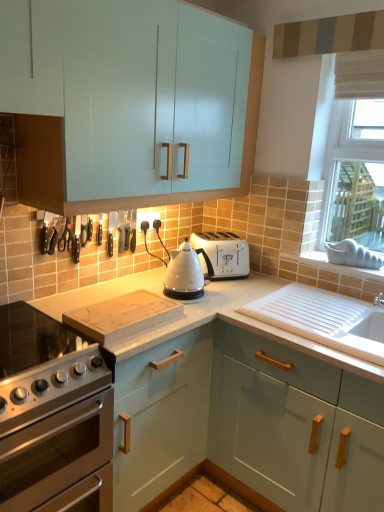
Question: Is satin silver gas stove at lower left taller than white ceramic sink at lower right?

Choices:
 (A) yes
 (B) no

Answer: (A)

Question: Does satin silver gas stove at lower left have a lesser width compared to white ceramic sink at lower right?

Choices:
 (A) yes
 (B) no

Answer: (B)

Question: Does satin silver gas stove at lower left turn towards white ceramic sink at lower right?

Choices:
 (A) no
 (B) yes

Answer: (A)

Question: Is white ceramic sink at lower right inside satin silver gas stove at lower left?

Choices:
 (A) no
 (B) yes

Answer: (A)

Question: Is satin silver gas stove at lower left closer to the viewer compared to white ceramic sink at lower right?

Choices:
 (A) no
 (B) yes

Answer: (B)

Question: Is satin silver gas stove at lower left at the left side of white ceramic sink at lower right?

Choices:
 (A) yes
 (B) no

Answer: (A)

Question: Does white plastic toaster at upper center contain matte striped panel at upper center?

Choices:
 (A) yes
 (B) no

Answer: (B)

Question: Is white plastic toaster at upper center closer to camera compared to matte striped panel at upper center?

Choices:
 (A) yes
 (B) no

Answer: (B)

Question: Is white plastic toaster at upper center turned away from matte striped panel at upper center?

Choices:
 (A) yes
 (B) no

Answer: (B)

Question: Is white plastic toaster at upper center completely or partially outside of matte striped panel at upper center?

Choices:
 (A) no
 (B) yes

Answer: (B)

Question: Is white plastic toaster at upper center oriented towards matte striped panel at upper center?

Choices:
 (A) yes
 (B) no

Answer: (B)

Question: Can you confirm if white plastic toaster at upper center is bigger than matte striped panel at upper center?

Choices:
 (A) no
 (B) yes

Answer: (B)

Question: Does wooden cutting board at center turn towards white fabric window at upper right?

Choices:
 (A) no
 (B) yes

Answer: (A)